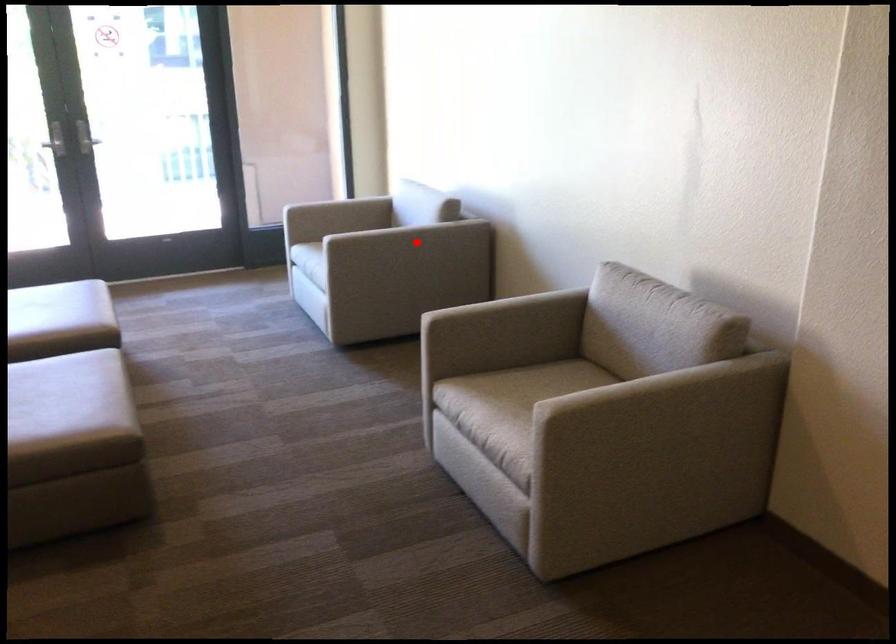
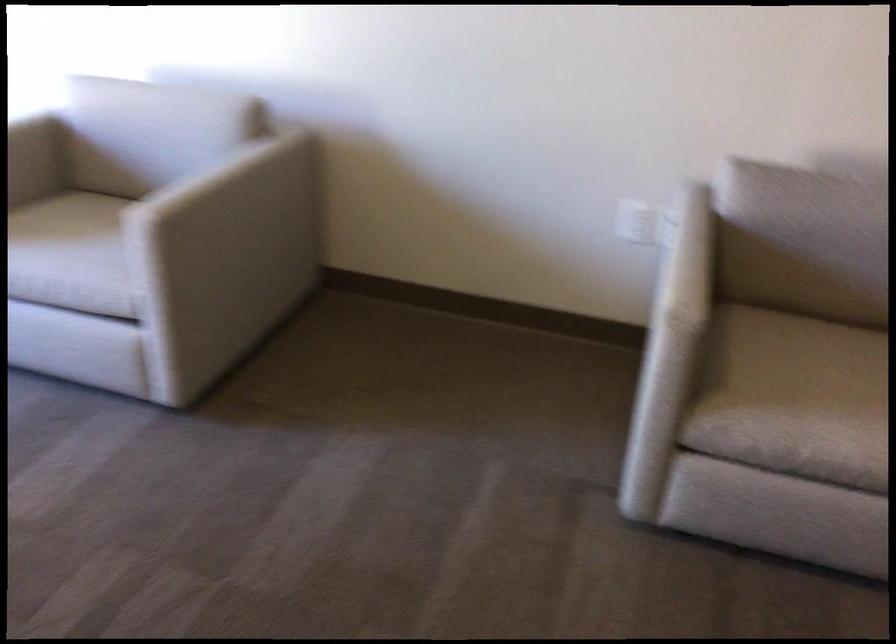
The point at the highlighted location is marked in the first image. Where is the corresponding point in the second image?

(295, 187)